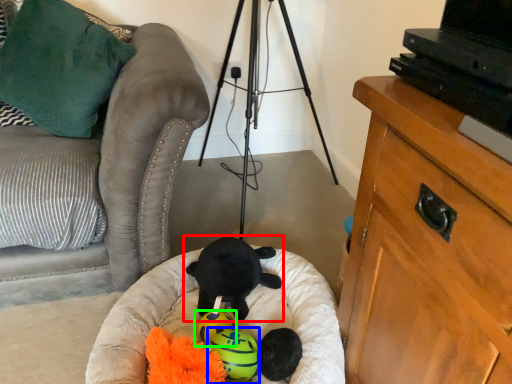
Question: Which object is the closest to the toy (highlighted by a red box)? Choose among these: toy (highlighted by a blue box) or toy (highlighted by a green box).

Choices:
 (A) toy
 (B) toy

Answer: (B)